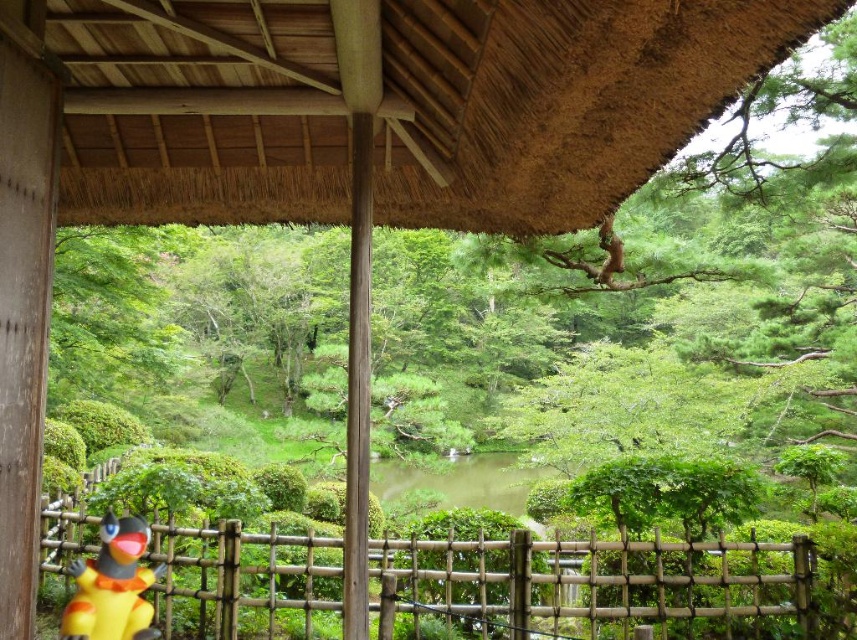
You are a visitor standing under the thatched roof structure in the Japanese garden. You notice the bamboo fence at lower center and the yellow matte toy at lower left. Which object is taller?

The bamboo fence at lower center is much taller than the yellow matte toy at lower left.

You are a visitor standing under the thatched straw roof at upper center and want to place a 3 feet long decoration between it and the bamboo fence at lower center. Will there be enough space?

The thatched straw roof at upper center is 8.92 feet from the bamboo fence at lower center. Since the decoration is 3 feet long, there is sufficient space to place it between them.

You are standing under the thatched roof structure and want to pick up the yellow matte toy at lower left. Can you reach it without moving past the bamboo fence at lower center?

The yellow matte toy at lower left is behind the bamboo fence at lower center, so you cannot reach it without moving past the bamboo fence at lower center.